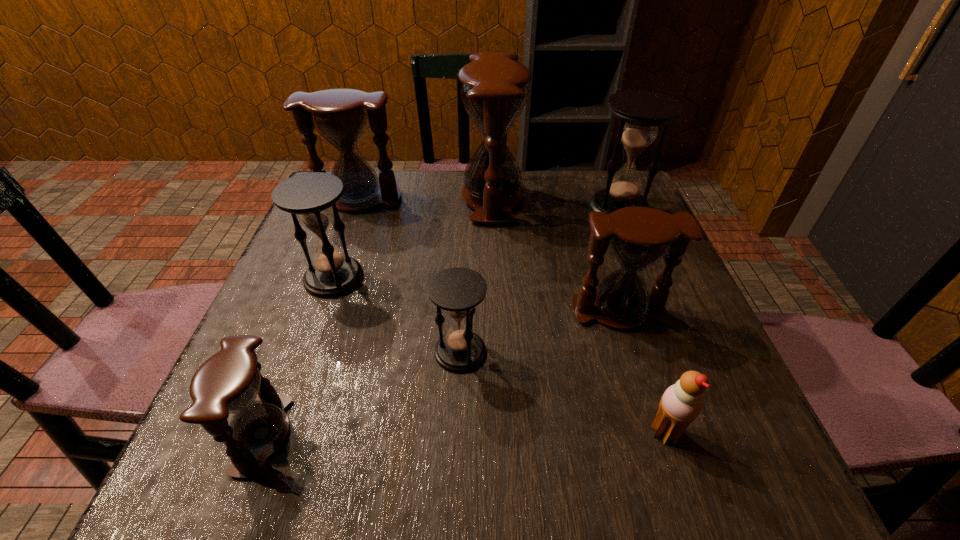
I want to click on the second brown hourglass from right to left, so click(x=494, y=92).

I want to click on the biggest brown hourglass, so click(x=494, y=92).

The width and height of the screenshot is (960, 540). What are the coordinates of `the biggest black hourglass` in the screenshot? It's located at (640, 112).

At what (x,y) coordinates should I click in order to perform the action: click on the rightmost black hourglass. Please return your answer as a coordinate pair (x, y). Looking at the image, I should click on (640, 112).

Identify the location of the second biggest brown hourglass. (340, 115).

Locate an element on the screen. the second nearest black hourglass is located at coordinates (310, 197).

Locate an element on the screen. This screenshot has width=960, height=540. the second biggest black hourglass is located at coordinates (310, 197).

Locate an element on the screen. the third biggest brown hourglass is located at coordinates (640, 237).

Locate an element on the screen. This screenshot has width=960, height=540. the second nearest brown hourglass is located at coordinates (640, 237).

At what (x,y) coordinates should I click in order to perform the action: click on the nearest black hourglass. Please return your answer as a coordinate pair (x, y). Looking at the image, I should click on (457, 291).